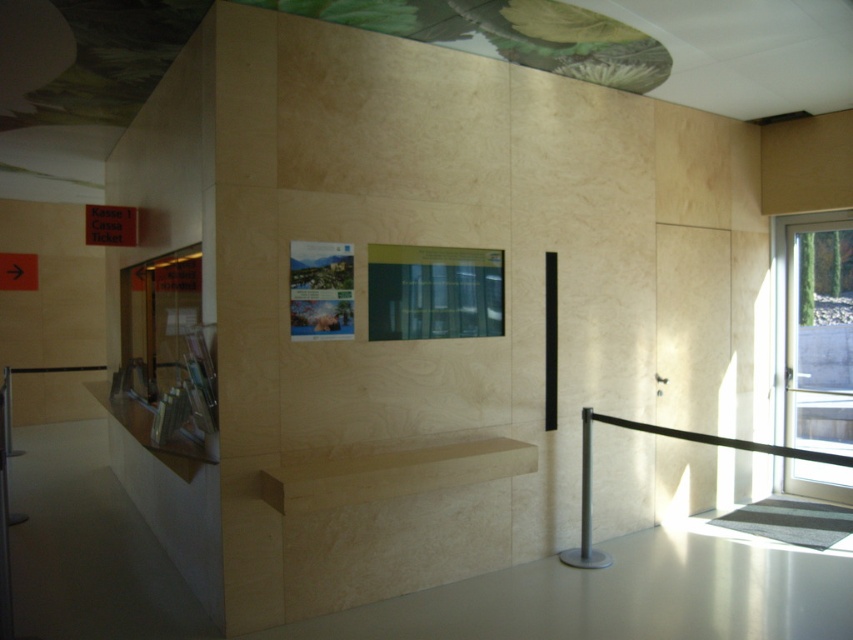
Does light wood shelf at center appear over black rubber barrier at right?

Yes.

Who is more distant from viewer, [321,504] or [688,433]?

The point [688,433] is more distant.

Is point (302, 508) less distant than point (804, 451)?

Yes.

This screenshot has height=640, width=853. I want to click on light wood shelf at center, so click(x=393, y=472).